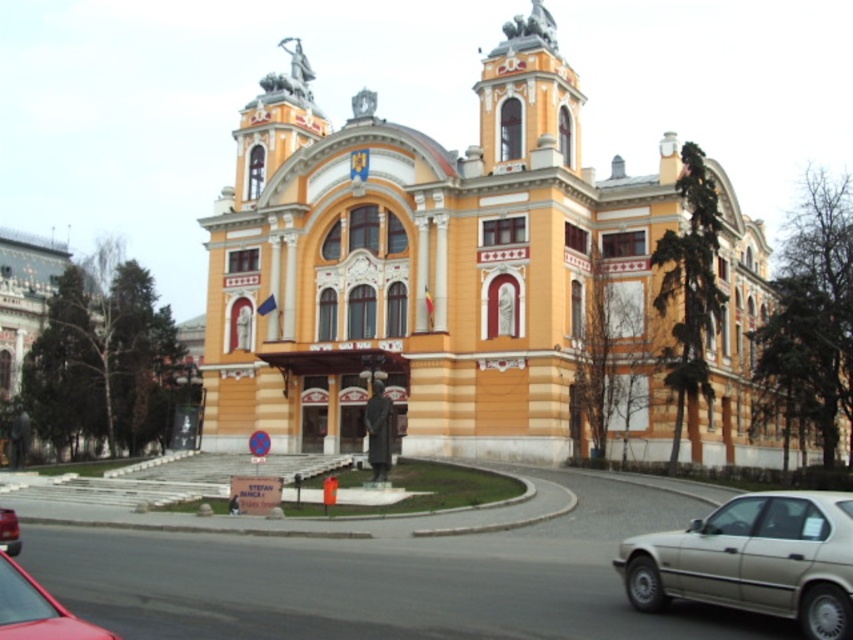
Question: Can you confirm if yellow stone building at center is bigger than silver metallic sedan at lower right?

Choices:
 (A) yes
 (B) no

Answer: (A)

Question: Is shiny red car at lower left closer to camera compared to metallic red car at lower left?

Choices:
 (A) yes
 (B) no

Answer: (A)

Question: Which object is the farthest from the yellow stone building at center?

Choices:
 (A) metallic red car at lower left
 (B) silver metallic sedan at lower right
 (C) shiny red car at lower left

Answer: (C)

Question: Among these objects, which one is farthest from the camera?

Choices:
 (A) shiny red car at lower left
 (B) metallic red car at lower left
 (C) silver metallic sedan at lower right
 (D) yellow stone building at center

Answer: (D)

Question: Considering the real-world distances, which object is farthest from the yellow stone building at center?

Choices:
 (A) metallic red car at lower left
 (B) silver metallic sedan at lower right

Answer: (A)

Question: In this image, where is yellow stone building at center located relative to metallic red car at lower left?

Choices:
 (A) right
 (B) left

Answer: (A)